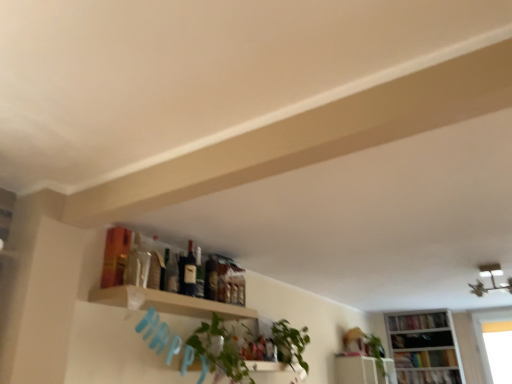
Find the location of a particular element. The height and width of the screenshot is (384, 512). hardcover book at lower right, which is the second book in bottom-to-top order is located at coordinates (426, 359).

Where is `hardcover book at upper right, the third book when ordered from top to bottom`? The width and height of the screenshot is (512, 384). hardcover book at upper right, the third book when ordered from top to bottom is located at coordinates (429, 377).

Where is `white wooden bookcase at lower right`? The image size is (512, 384). white wooden bookcase at lower right is located at coordinates (425, 348).

Describe the element at coordinates (199, 273) in the screenshot. I see `green glass bottle at center, the 2th bottle positioned from the front` at that location.

What is the approximate width of green leafy plant at center?

The width of green leafy plant at center is 12.11 inches.

This screenshot has width=512, height=384. In order to click on wooden shelf at upper center, the second shelf positioned from the back in this screenshot , I will do `click(167, 303)`.

What do you see at coordinates (167, 303) in the screenshot? I see `wooden shelf at upper center, the 1th shelf from the top` at bounding box center [167, 303].

Where is `hardcover book at lower right, which is the second book in bottom-to-top order`? Image resolution: width=512 pixels, height=384 pixels. hardcover book at lower right, which is the second book in bottom-to-top order is located at coordinates (426, 359).

Which object is closer to the camera taking this photo, wooden shelf at upper center, the 1th shelf when ordered from left to right, or hardcover book at upper right, the third book when ordered from top to bottom?

wooden shelf at upper center, the 1th shelf when ordered from left to right, is closer to the camera.

From a real-world perspective, which is physically above, wooden shelf at upper center, the second shelf positioned from the back, or hardcover book at upper right, placed as the 1th book when sorted from bottom to top?

wooden shelf at upper center, the second shelf positioned from the back.

Is point (120, 286) closer or farther from the camera than point (402, 382)?

Point (120, 286) is positioned closer to the camera compared to point (402, 382).

Is wooden shelf at upper center, the 1th shelf positioned from the front, looking in the opposite direction of hardcover book at upper right, the third book when ordered from top to bottom?

No, wooden shelf at upper center, the 1th shelf positioned from the front, is not facing away from hardcover book at upper right, the third book when ordered from top to bottom.

Considering the positions of objects white glossy shelf at upper center, which is the 2th shelf from front to back, and green glass bottle at center, positioned as the 1th bottle in back-to-front order, in the image provided, who is more to the right, white glossy shelf at upper center, which is the 2th shelf from front to back, or green glass bottle at center, positioned as the 1th bottle in back-to-front order,?

white glossy shelf at upper center, which is the 2th shelf from front to back.

From a real-world perspective, between white glossy shelf at upper center, the second shelf viewed from the left, and green glass bottle at center, positioned as the 1th bottle in back-to-front order, who is vertically lower?

In real-world perspective, white glossy shelf at upper center, the second shelf viewed from the left, is lower.

From the image's perspective, is white glossy shelf at upper center, which is the 2th shelf in top-to-bottom order, positioned above or below green glass bottle at center, positioned as the 1th bottle in back-to-front order?

white glossy shelf at upper center, which is the 2th shelf in top-to-bottom order, is situated lower than green glass bottle at center, positioned as the 1th bottle in back-to-front order, in the image.

From a real-world perspective, count 2nd shelfs downward from the green glass bottle at center, the 2th bottle positioned from the front, and point to it. Please provide its 2D coordinates.

[(362, 370)]

Can wooden shelf at upper center, the second shelf positioned from the back, be found inside matte glass bottle at center, arranged as the 1th bottle when viewed from the front?

Definitely not — wooden shelf at upper center, the second shelf positioned from the back, is not inside matte glass bottle at center, arranged as the 1th bottle when viewed from the front.

Does matte glass bottle at center, which appears as the 2th bottle when viewed from the back, have a greater height compared to wooden shelf at upper center, the 1th shelf from the top?

Correct, matte glass bottle at center, which appears as the 2th bottle when viewed from the back, is much taller as wooden shelf at upper center, the 1th shelf from the top.

Is matte glass bottle at center, which appears as the 2th bottle when viewed from the back, facing towards wooden shelf at upper center, the 1th shelf from the top?

No, matte glass bottle at center, which appears as the 2th bottle when viewed from the back, is not oriented towards wooden shelf at upper center, the 1th shelf from the top.

Considering the relative sizes of matte glass bottle at center, which appears as the 2th bottle when viewed from the back, and wooden shelf at upper center, the 1th shelf from the top, in the image provided, is matte glass bottle at center, which appears as the 2th bottle when viewed from the back, wider than wooden shelf at upper center, the 1th shelf from the top,?

No.

Would you say white glossy shelf at upper center, which ranks as the 1th shelf in bottom-to-top order, is outside wooden shelf at upper center, the 1th shelf from the top?

white glossy shelf at upper center, which ranks as the 1th shelf in bottom-to-top order, lies outside wooden shelf at upper center, the 1th shelf from the top,'s area.

In the image, is white glossy shelf at upper center, which is the 2th shelf from front to back, positioned in front of or behind wooden shelf at upper center, the 1th shelf when ordered from left to right?

white glossy shelf at upper center, which is the 2th shelf from front to back, is behind wooden shelf at upper center, the 1th shelf when ordered from left to right.

Between point (334, 357) and point (234, 313), which one is positioned in front?

Point (234, 313)

From the image's perspective, is white glossy shelf at upper center, the second shelf viewed from the left, on top of wooden shelf at upper center, the 2th shelf ordered from the bottom?

No, from the image's perspective, white glossy shelf at upper center, the second shelf viewed from the left, is not above wooden shelf at upper center, the 2th shelf ordered from the bottom.

Which object is closer to the camera taking this photo, wooden shelf at upper center, the 2th shelf ordered from the bottom, or white wooden bookcase at lower right?

wooden shelf at upper center, the 2th shelf ordered from the bottom, is closer to the camera.

Is point (256, 316) closer to viewer compared to point (395, 329)?

Yes, point (256, 316) is in front of point (395, 329).

From a real-world perspective, between wooden shelf at upper center, the 2th shelf ordered from the bottom, and white wooden bookcase at lower right, who is vertically higher?

wooden shelf at upper center, the 2th shelf ordered from the bottom, from a real-world perspective.

Is wooden shelf at upper center, the 1th shelf when ordered from left to right, shorter than white wooden bookcase at lower right?

Yes, wooden shelf at upper center, the 1th shelf when ordered from left to right, is shorter than white wooden bookcase at lower right.

Are white glossy shelf at upper center, the 1th shelf viewed from the right, and matte glass bottle at center, which appears as the 2th bottle when viewed from the back, far apart?

white glossy shelf at upper center, the 1th shelf viewed from the right, is far away from matte glass bottle at center, which appears as the 2th bottle when viewed from the back.

From the picture: Which is closer to the camera, (362, 359) or (187, 267)?

The point (187, 267) is closer to the camera.

In terms of width, does white glossy shelf at upper center, the second shelf viewed from the left, look wider or thinner when compared to matte glass bottle at center, which appears as the 2th bottle when viewed from the back?

In the image, white glossy shelf at upper center, the second shelf viewed from the left, appears to be wider than matte glass bottle at center, which appears as the 2th bottle when viewed from the back.

Can we say white wooden bookcase at lower right lies outside hardcover book at upper right, the third book when ordered from top to bottom?

Absolutely, white wooden bookcase at lower right is external to hardcover book at upper right, the third book when ordered from top to bottom.

From the image's perspective, is white wooden bookcase at lower right positioned above or below hardcover book at upper right, the third book when ordered from top to bottom?

Based on their image positions, white wooden bookcase at lower right is located above hardcover book at upper right, the third book when ordered from top to bottom.

Considering the sizes of objects white wooden bookcase at lower right and hardcover book at upper right, placed as the 1th book when sorted from bottom to top, in the image provided, who is thinner, white wooden bookcase at lower right or hardcover book at upper right, placed as the 1th book when sorted from bottom to top,?

hardcover book at upper right, placed as the 1th book when sorted from bottom to top.

Which is further, (426, 316) or (410, 371)?

The point (426, 316) is more distant.

This screenshot has width=512, height=384. Find the location of `the 1st book behind when counting from the wooden shelf at upper center, the 1th shelf positioned from the front`. the 1st book behind when counting from the wooden shelf at upper center, the 1th shelf positioned from the front is located at coordinates (429, 377).

At what (x,y) coordinates should I click in order to perform the action: click on shelf on the right of the green glass bottle at center, the 2th bottle positioned from the front. Please return your answer as a coordinate pair (x, y). The image size is (512, 384). Looking at the image, I should click on (362, 370).

Based on the photo, which object lies further to the anchor point matte black bookshelf at upper right, the 1th book from the top, matte glass bottle at center, which appears as the 2th bottle when viewed from the back, or green leafy plant at center?

matte glass bottle at center, which appears as the 2th bottle when viewed from the back, is positioned further to the anchor matte black bookshelf at upper right, the 1th book from the top.

Looking at the image, which one is located closer to green glass bottle at center, positioned as the 1th bottle in back-to-front order, white glossy shelf at upper center, which ranks as the 1th shelf in bottom-to-top order, or white wooden bookcase at lower right?

white glossy shelf at upper center, which ranks as the 1th shelf in bottom-to-top order, lies closer to green glass bottle at center, positioned as the 1th bottle in back-to-front order, than the other object.

Based on their spatial positions, is white wooden bookcase at lower right or green leafy plant at upper center further from white glossy shelf at upper center, the second shelf viewed from the left?

The object further to white glossy shelf at upper center, the second shelf viewed from the left, is white wooden bookcase at lower right.

Looking at this image, when comparing their distances from matte black bookshelf at upper right, the 1th book from the top, does green leafy plant at center or green leafy plant at upper center seem further?

green leafy plant at center is further to matte black bookshelf at upper right, the 1th book from the top.

When comparing their distances from matte black bookshelf at upper right, the 3th book ordered from the bottom, does matte glass bottle at center, arranged as the 1th bottle when viewed from the front, or green leafy plant at upper center seem closer?

Among the two, green leafy plant at upper center is located nearer to matte black bookshelf at upper right, the 3th book ordered from the bottom.

Estimate the real-world distances between objects in this image. Which object is further from matte glass bottle at center, which appears as the 2th bottle when viewed from the back, wooden shelf at upper center, the 1th shelf when ordered from left to right, or hardcover book at lower right, which appears as the 2th book when viewed from the top?

hardcover book at lower right, which appears as the 2th book when viewed from the top, is positioned further to the anchor matte glass bottle at center, which appears as the 2th bottle when viewed from the back.

Looking at the image, which one is located closer to white glossy shelf at upper center, which ranks as the 1th shelf in bottom-to-top order, green leafy plant at upper center or white wooden bookcase at lower right?

green leafy plant at upper center lies closer to white glossy shelf at upper center, which ranks as the 1th shelf in bottom-to-top order, than the other object.

Considering their positions, is wooden shelf at upper center, the 1th shelf when ordered from left to right, positioned closer to matte black bookshelf at upper right, the 1th book from the top, than hardcover book at lower right, which is the second book in bottom-to-top order?

hardcover book at lower right, which is the second book in bottom-to-top order.

Locate an element on the screen. This screenshot has width=512, height=384. book between green glass bottle at center, the 2th bottle positioned from the front, and hardcover book at lower right, which is the second book in bottom-to-top order, along the z-axis is located at coordinates (429, 377).

You are a GUI agent. You are given a task and a screenshot of the screen. Output one action in this format:
    pyautogui.click(x=<x>, y=<y>)
    Task: Click on the plant located between wooden shelf at upper center, the 2th shelf ordered from the bottom, and matte black bookshelf at upper right, the 1th book from the top, in the depth direction
    This screenshot has width=512, height=384.
    Given the screenshot: What is the action you would take?
    pyautogui.click(x=290, y=343)

Find the location of a particular element. Image resolution: width=512 pixels, height=384 pixels. plant located between green leafy plant at center and white wooden bookcase at lower right in the depth direction is located at coordinates (290, 343).

In order to click on bookcase between white glossy shelf at upper center, which is the 2th shelf in top-to-bottom order, and matte black bookshelf at upper right, the 3th book ordered from the bottom, along the z-axis in this screenshot , I will do `click(425, 348)`.